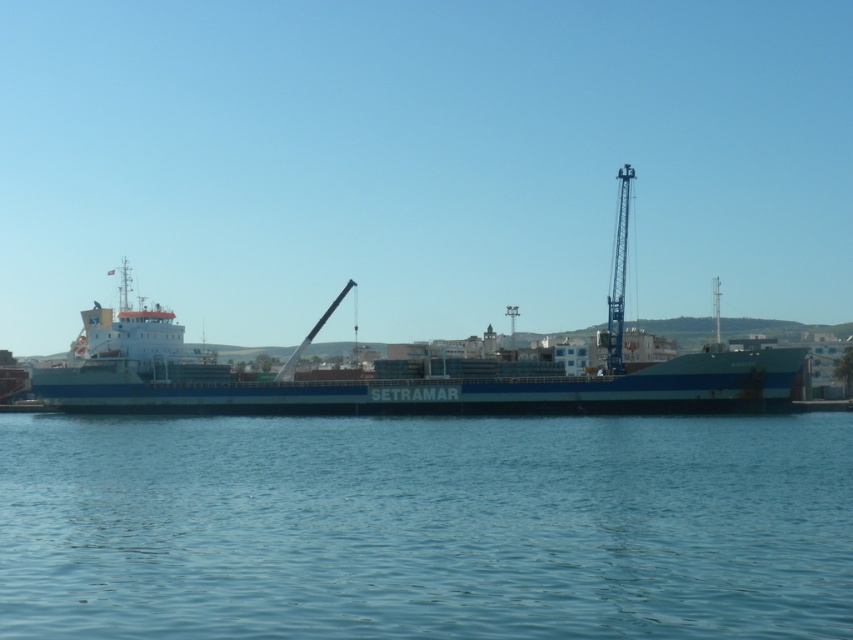
Question: Which point is closer to the camera taking this photo?

Choices:
 (A) (753, 384)
 (B) (381, 632)

Answer: (B)

Question: Does blue liquid water at center appear under blue matte cargo ship at center?

Choices:
 (A) yes
 (B) no

Answer: (A)

Question: Which point is closer to the camera?

Choices:
 (A) blue matte cargo ship at center
 (B) blue liquid water at center

Answer: (B)

Question: Can you confirm if blue liquid water at center is positioned to the right of blue matte cargo ship at center?

Choices:
 (A) yes
 (B) no

Answer: (A)

Question: Can you confirm if blue liquid water at center is bigger than blue matte cargo ship at center?

Choices:
 (A) no
 (B) yes

Answer: (A)